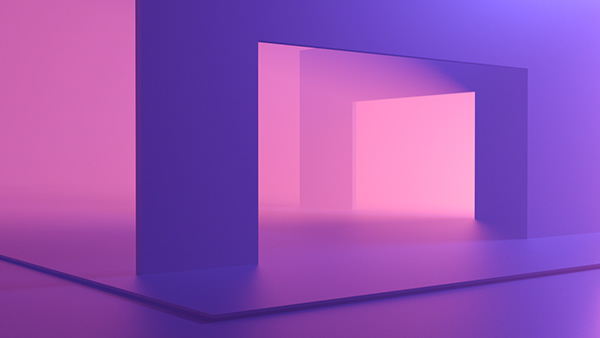
Look for where wall meets the floor in the image and show me where they are. Your answer should be formatted as a list of tuples, i.e. [(x1, y1), (x2, y2), ...], where each tuple contains the x and y coordinates of a point satisfying the conditions above.

[(187, 268)]